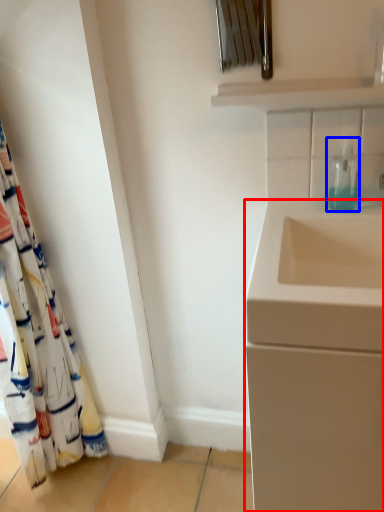
Question: Which point is further to the camera, bathroom cabinet (highlighted by a red box) or soap dispenser (highlighted by a blue box)?

Choices:
 (A) bathroom cabinet
 (B) soap dispenser

Answer: (B)